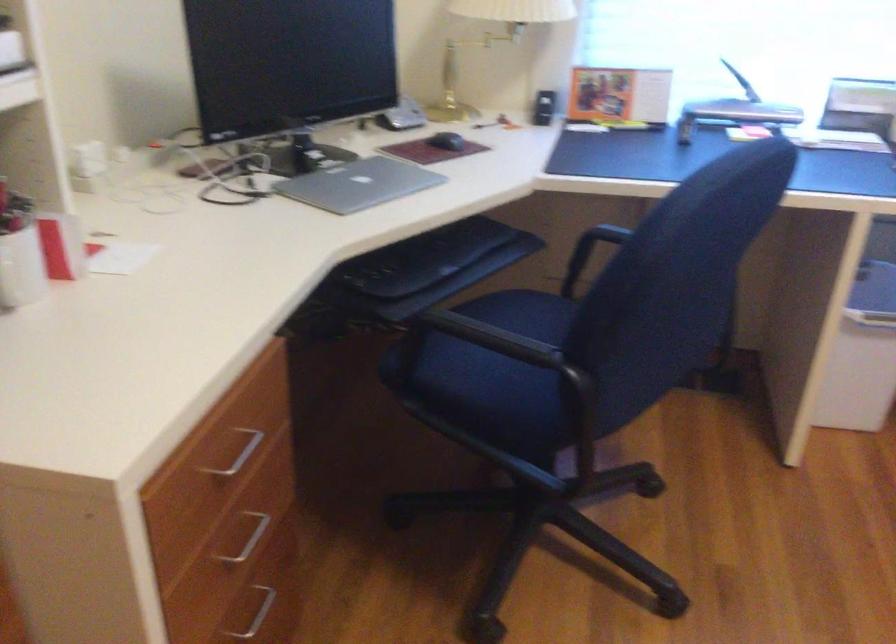
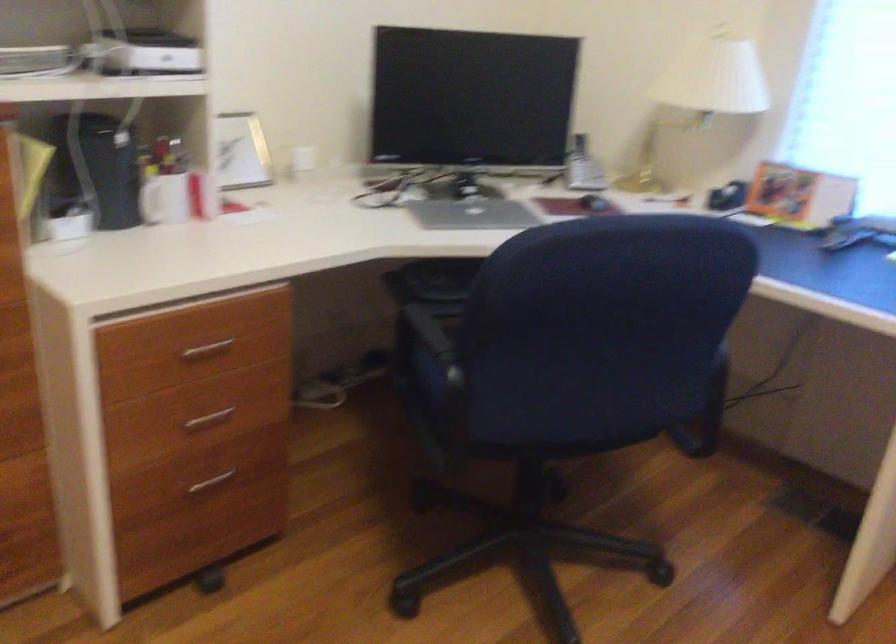
Question: The camera is either moving clockwise (left) or counter-clockwise (right) around the object. The first image is from the beginning of the video and the second image is from the end. Is the camera moving left or right when shooting the video?

Choices:
 (A) Left
 (B) Right

Answer: (B)